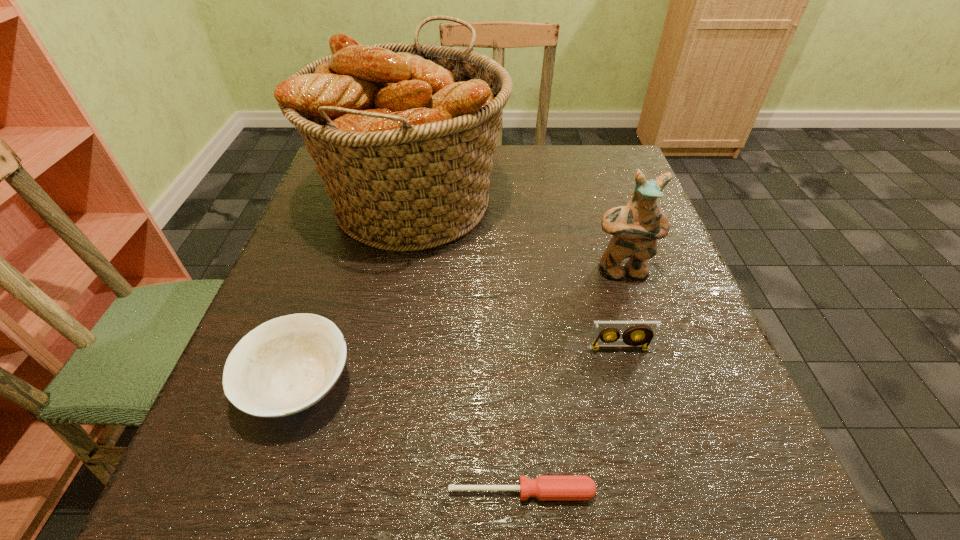
Locate an element on the screen. Image resolution: width=960 pixels, height=540 pixels. vacant point located on the left of the shortest object is located at coordinates (189, 492).

I want to click on object that is positioned at the far edge, so click(403, 135).

At what (x,y) coordinates should I click in order to perform the action: click on object at the near edge. Please return your answer as a coordinate pair (x, y). This screenshot has width=960, height=540. Looking at the image, I should click on (543, 487).

Identify the location of basket that is at the left edge. The image size is (960, 540). (403, 135).

I want to click on bowl at the left edge, so click(287, 364).

Locate an element on the screen. The image size is (960, 540). figurine located at the right edge is located at coordinates (636, 227).

The width and height of the screenshot is (960, 540). Find the location of `videotape that is at the right edge`. videotape that is at the right edge is located at coordinates (646, 330).

Identify the location of object at the far left corner. (403, 135).

In the image, there is a desktop. At what (x,y) coordinates should I click in order to perform the action: click on vacant space at the far edge. Please return your answer as a coordinate pair (x, y). Looking at the image, I should click on (511, 170).

In the image, there is a desktop. Find the location of `free space at the near edge`. free space at the near edge is located at coordinates click(x=379, y=495).